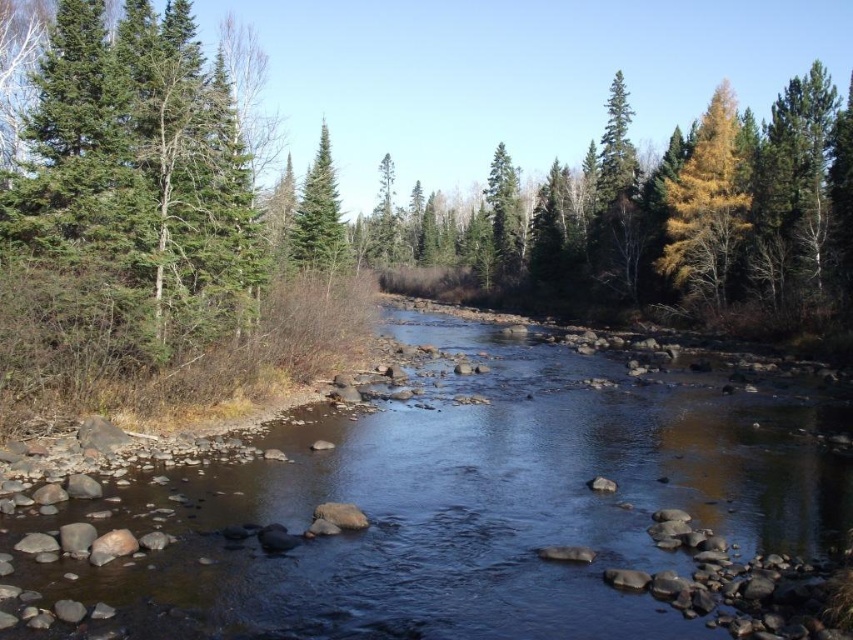
Question: From the image, what is the correct spatial relationship of yellow/golden wood at upper right in relation to green matte tree at center?

Choices:
 (A) right
 (B) left

Answer: (A)

Question: Estimate the real-world distances between objects in this image. Which object is closer to the yellow/golden wood at upper right?

Choices:
 (A) green matte tree at center
 (B) smooth rock stream at center

Answer: (A)

Question: Where is smooth rock stream at center located in relation to yellow/golden wood at upper right in the image?

Choices:
 (A) right
 (B) left

Answer: (B)

Question: Which point is farther to the camera?

Choices:
 (A) yellow/golden wood at upper right
 (B) smooth rock stream at center

Answer: (A)

Question: Among these objects, which one is farthest from the camera?

Choices:
 (A) yellow/golden wood at upper right
 (B) smooth rock stream at center

Answer: (A)

Question: Is yellow/golden wood at upper right smaller than green matte tree at center?

Choices:
 (A) no
 (B) yes

Answer: (A)